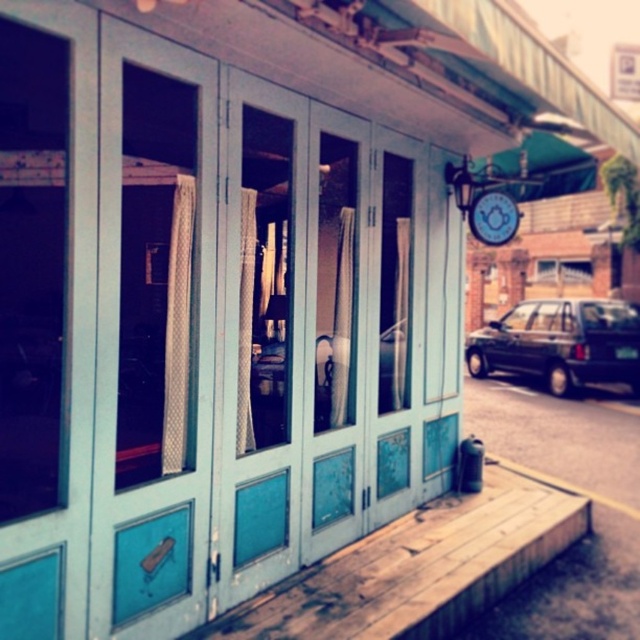
You are a delivery person arriving at this building and need to park your dark green matte van at right. The building has a matte blue clock at upper center. Where should you position your van relative to the clock?

The dark green matte van at right should be positioned below the matte blue clock at upper center as it is located below it.

You are a delivery person approaching the entrance of the building. You see a translucent glass screen door at left and a transparent glass door at left. Which door should you use to enter the building?

The translucent glass screen door at left is bigger than the transparent glass door at left, so you should use the translucent glass screen door at left to enter the building since it is larger and likely the main entrance.